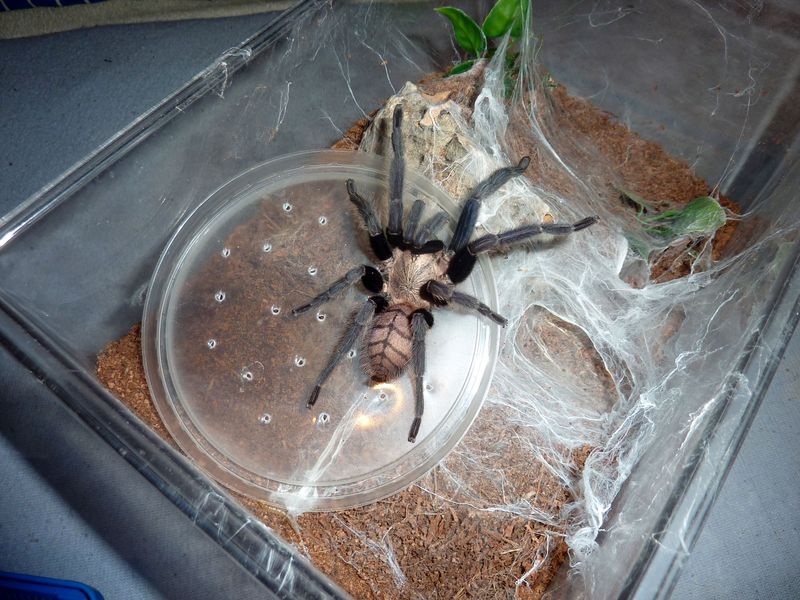
Locate an element on the screen. glass tray is located at coordinates (110, 190), (693, 501), (781, 317), (658, 576), (72, 400), (36, 346).